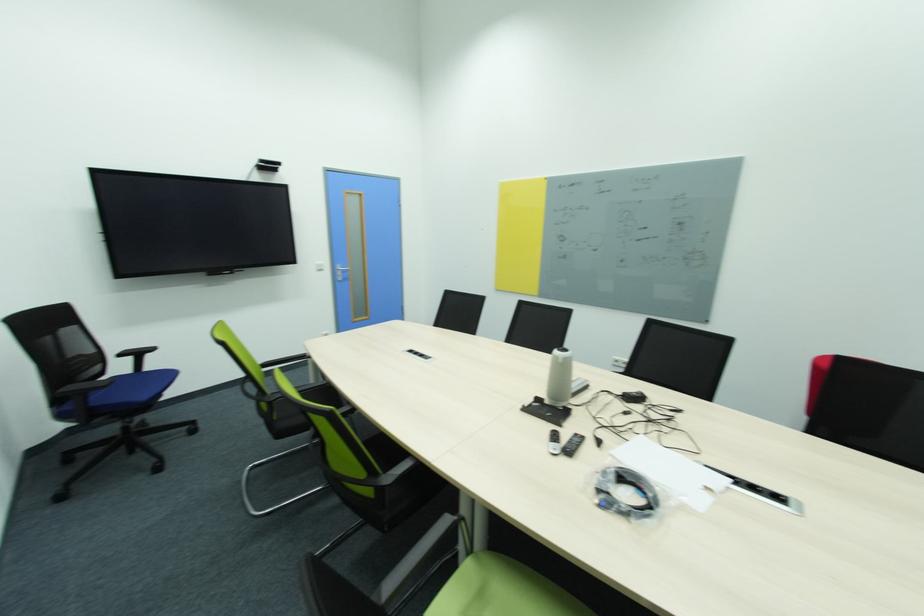
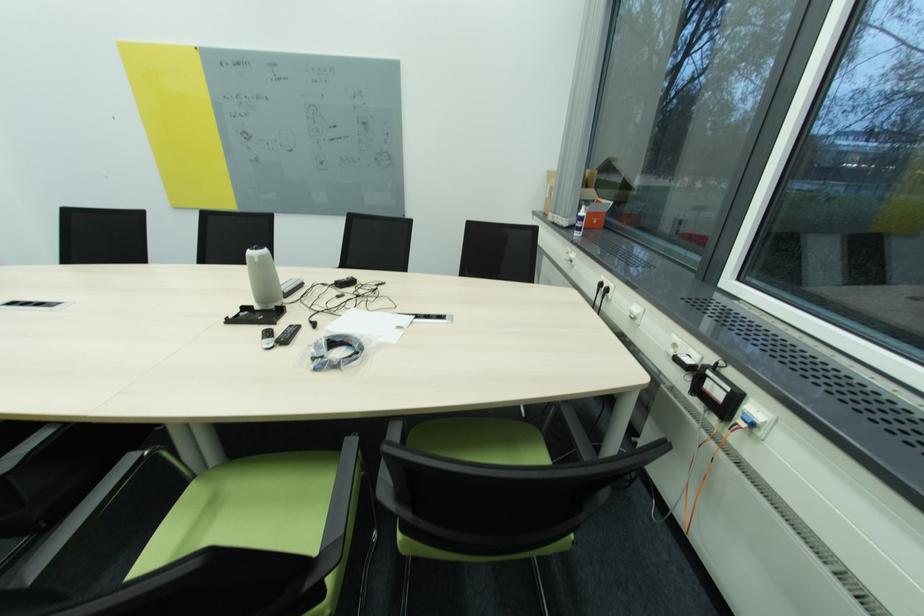
Find the pixel in the second image that matches [580,436] in the first image.

(296, 328)